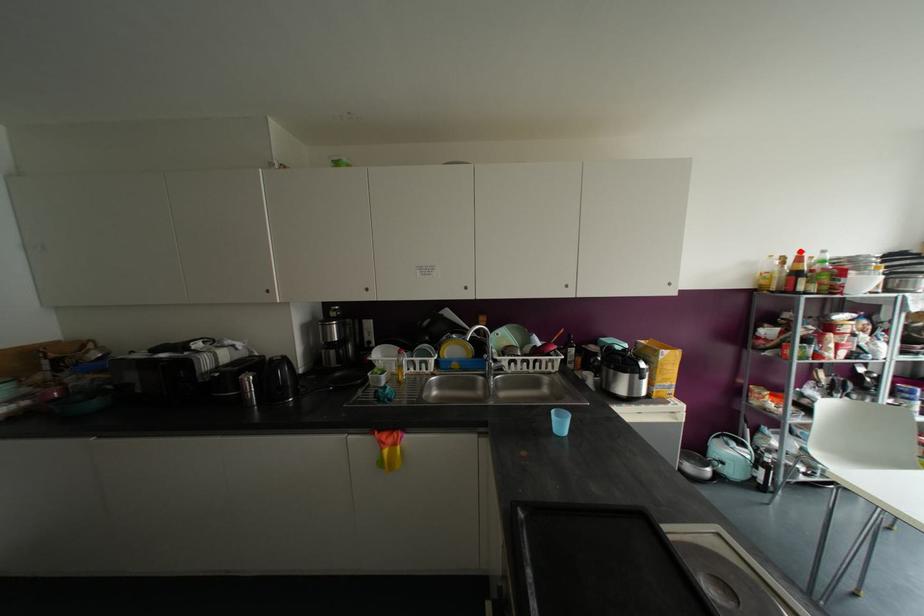
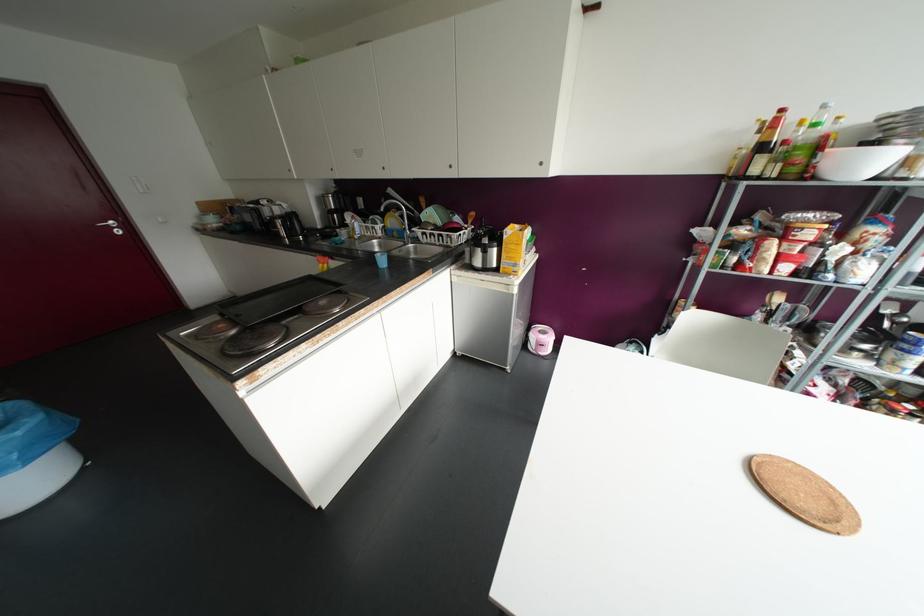
Where in the second image is the point corresponding to the highlighted location from the first image?

(781, 110)